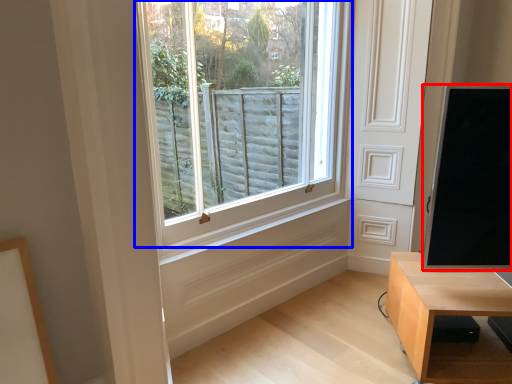
Question: Which of the following is the farthest to the observer, window screen (highlighted by a red box) or window (highlighted by a blue box)?

Choices:
 (A) window screen
 (B) window

Answer: (B)